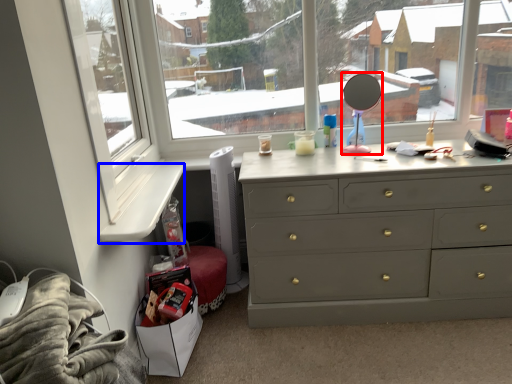
Question: Among these objects, which one is nearest to the camera, mirror (highlighted by a red box) or window sill (highlighted by a blue box)?

Choices:
 (A) mirror
 (B) window sill

Answer: (B)